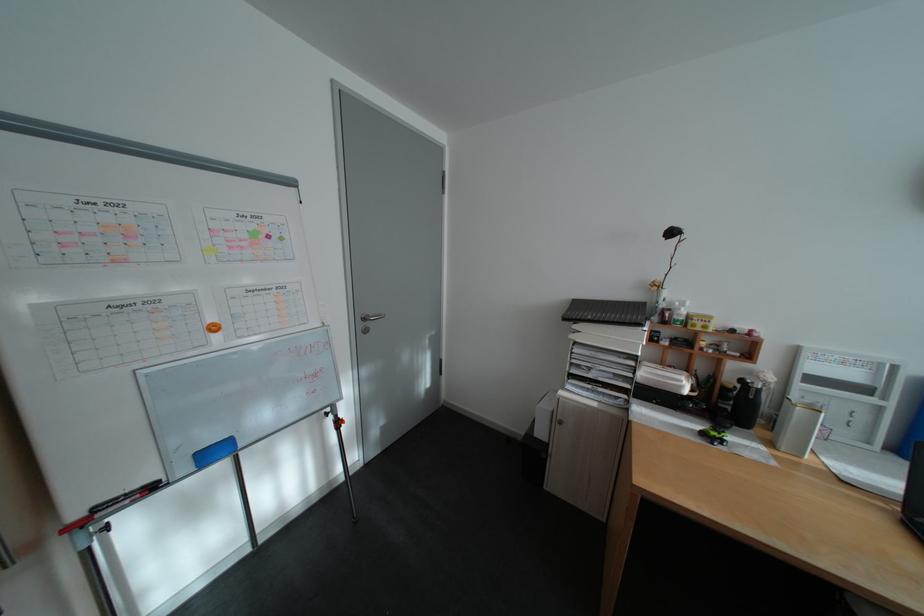
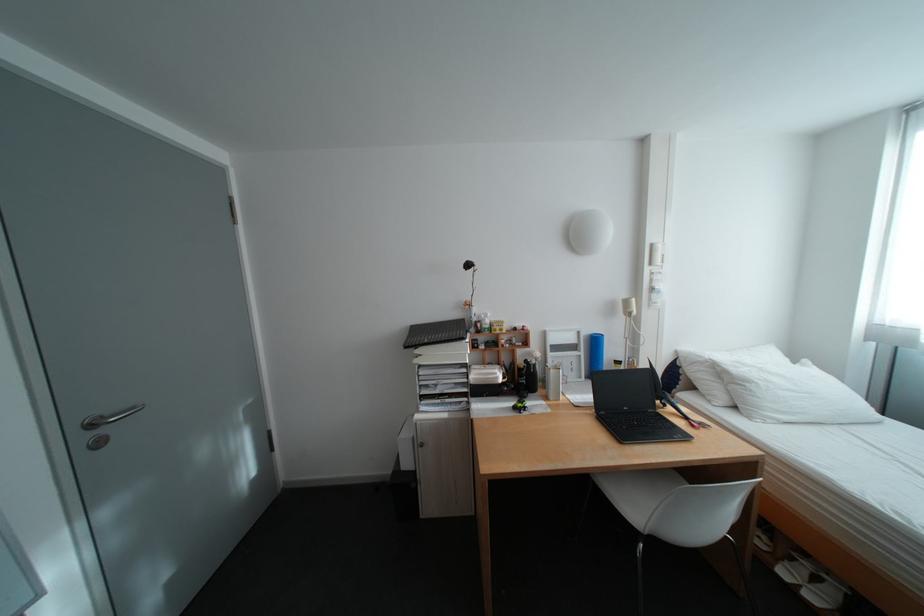
Question: The camera is either moving clockwise (left) or counter-clockwise (right) around the object. The first image is from the beginning of the video and the second image is from the end. Is the camera moving left or right when shooting the video?

Choices:
 (A) Left
 (B) Right

Answer: (A)